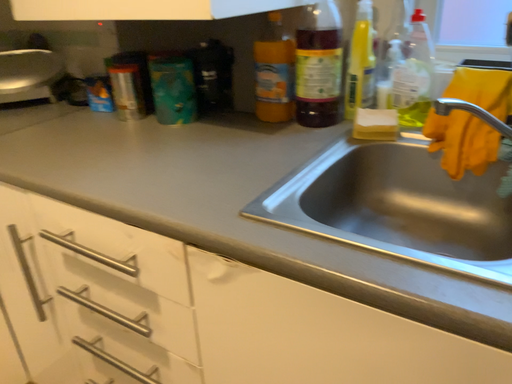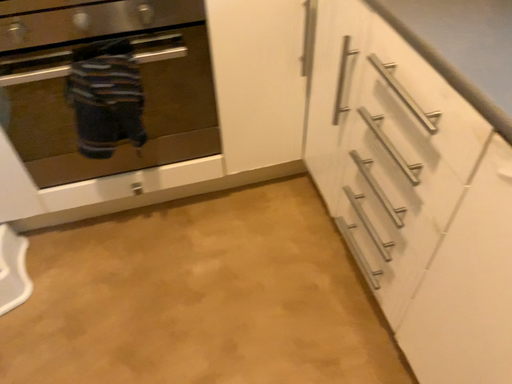
Question: Which way did the camera rotate in the video?

Choices:
 (A) rotated upward
 (B) rotated downward

Answer: (B)